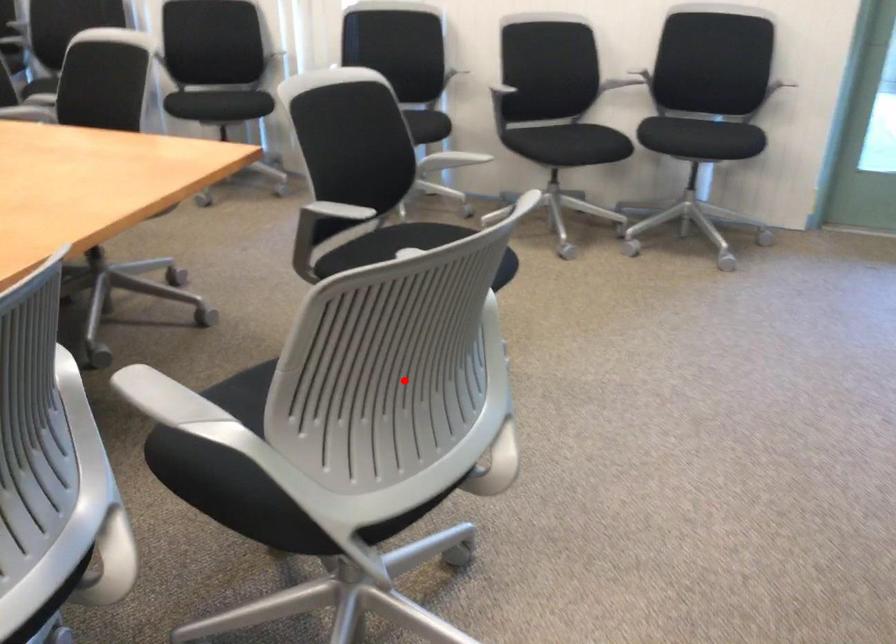
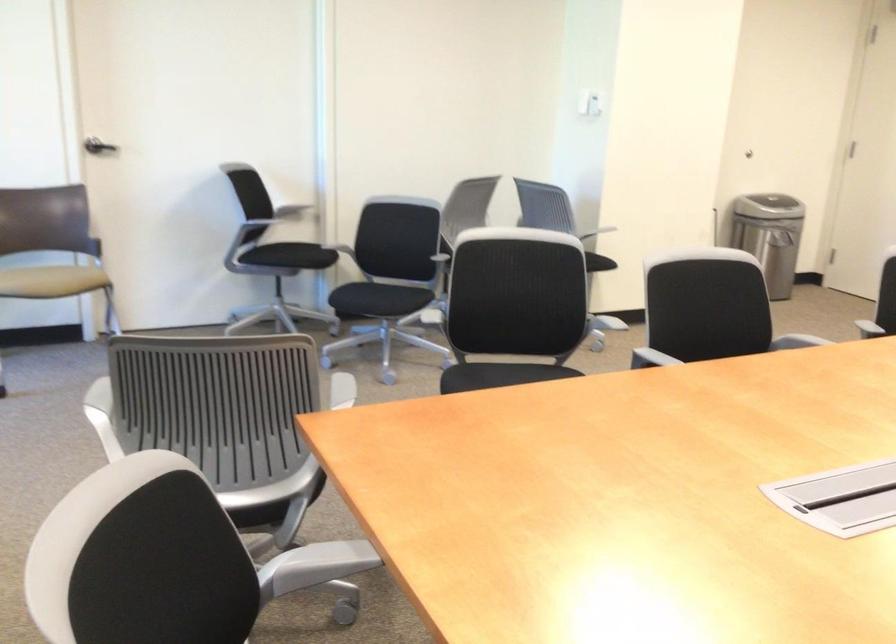
Question: A red point is marked in image1. In image2, is the corresponding 3D point closer to the camera or farther? Reply with the corresponding letter.

Choices:
 (A) The corresponding 3D point is closer.
 (B) The corresponding 3D point is farther.

Answer: (B)